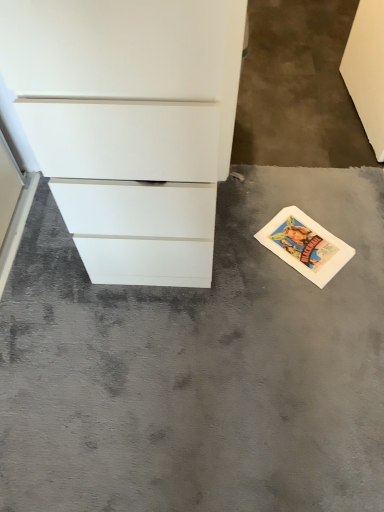
What is the approximate width of white matte chest of drawers at left?

It is 19.99 inches.

What is the approximate height of white matte chest of drawers at left?

white matte chest of drawers at left is 35.75 inches tall.

This screenshot has height=512, width=384. What do you see at coordinates (305, 245) in the screenshot?
I see `white paper postcard at lower right` at bounding box center [305, 245].

Measure the distance between point [336,246] and camera.

Point [336,246] is 4.90 feet from camera.

The image size is (384, 512). I want to click on white matte chest of drawers at left, so click(x=130, y=124).

Looking at their sizes, would you say gray concrete at lower right is wider or thinner than white paper postcard at lower right?

Considering their sizes, gray concrete at lower right looks broader than white paper postcard at lower right.

From a real-world perspective, is gray concrete at lower right below white paper postcard at lower right?

No, from a real-world perspective, gray concrete at lower right is not below white paper postcard at lower right.

Which is more to the left, gray concrete at lower right or white paper postcard at lower right?

gray concrete at lower right is more to the left.

Is gray concrete at lower right positioned behind white paper postcard at lower right?

No, the depth of gray concrete at lower right is less than that of white paper postcard at lower right.

From the image's perspective, between white paper postcard at lower right and gray concrete at lower right, which one is located above?

white paper postcard at lower right, from the image's perspective.

Which object is wider, white paper postcard at lower right or gray concrete at lower right?

With larger width is gray concrete at lower right.

Is white paper postcard at lower right smaller than gray concrete at lower right?

Yes.

Based on the photo, can we say white paper postcard at lower right lies outside gray concrete at lower right?

No, white paper postcard at lower right is not outside of gray concrete at lower right.

This screenshot has height=512, width=384. What are the coordinates of `chest of drawers above the white paper postcard at lower right (from a real-world perspective)` in the screenshot? It's located at (130, 124).

From a real-world perspective, is white paper postcard at lower right beneath white matte chest of drawers at left?

Yes, from a real-world perspective, white paper postcard at lower right is below white matte chest of drawers at left.

From the image's perspective, which one is positioned lower, white paper postcard at lower right or white matte chest of drawers at left?

white paper postcard at lower right appears lower in the image.

Is white matte chest of drawers at left located within white paper postcard at lower right?

Actually, white matte chest of drawers at left is outside white paper postcard at lower right.

Looking at the image, does white matte chest of drawers at left seem bigger or smaller compared to gray concrete at lower right?

Clearly, white matte chest of drawers at left is larger in size than gray concrete at lower right.

In terms of width, does white matte chest of drawers at left look wider or thinner when compared to gray concrete at lower right?

In the image, white matte chest of drawers at left appears to be more narrow than gray concrete at lower right.

Could you tell me if white matte chest of drawers at left is turned towards white paper postcard at lower right?

No.

Is white matte chest of drawers at left next to white paper postcard at lower right and touching it?

No, white matte chest of drawers at left is not touching white paper postcard at lower right.

Is white matte chest of drawers at left surrounding white paper postcard at lower right?

No, white paper postcard at lower right is not surrounded by white matte chest of drawers at left.

Which point is more forward, (190,254) or (304,260)?

The point (304,260) is more forward.

Which object is wider, gray concrete at lower right or white matte chest of drawers at left?

With larger width is gray concrete at lower right.

Is the position of gray concrete at lower right less distant than that of white matte chest of drawers at left?

No.

Is gray concrete at lower right next to white matte chest of drawers at left?

gray concrete at lower right is not next to white matte chest of drawers at left, and they're not touching.

Is gray concrete at lower right inside or outside of white matte chest of drawers at left?

gray concrete at lower right is not inside white matte chest of drawers at left, it's outside.

You are a GUI agent. You are given a task and a screenshot of the screen. Output one action in this format:
    pyautogui.click(x=<x>, y=<y>)
    Task: Click on the postcard on the right of gray concrete at lower right
    
    Given the screenshot: What is the action you would take?
    pyautogui.click(x=305, y=245)

This screenshot has width=384, height=512. I want to click on postcard behind the gray concrete at lower right, so click(x=305, y=245).

In the scene shown: Based on their spatial positions, is white matte chest of drawers at left or gray concrete at lower right closer to white paper postcard at lower right?

Based on the image, gray concrete at lower right appears to be nearer to white paper postcard at lower right.

When comparing their distances from white paper postcard at lower right, does gray concrete at lower right or white matte chest of drawers at left seem closer?

Based on the image, gray concrete at lower right appears to be nearer to white paper postcard at lower right.

Consider the image. Considering their positions, is white paper postcard at lower right positioned closer to white matte chest of drawers at left than gray concrete at lower right?

→ The object closer to white matte chest of drawers at left is gray concrete at lower right.

From the image, which object appears to be nearer to white matte chest of drawers at left, gray concrete at lower right or white paper postcard at lower right?

The object closer to white matte chest of drawers at left is gray concrete at lower right.

From the image, which object appears to be farther from gray concrete at lower right, white matte chest of drawers at left or white paper postcard at lower right?

white matte chest of drawers at left is positioned further to the anchor gray concrete at lower right.

Based on their spatial positions, is white paper postcard at lower right or white matte chest of drawers at left further from gray concrete at lower right?

Based on the image, white matte chest of drawers at left appears to be further to gray concrete at lower right.

Find the location of a particular element. The image size is (384, 512). concrete positioned between white matte chest of drawers at left and white paper postcard at lower right from near to far is located at coordinates (200, 366).